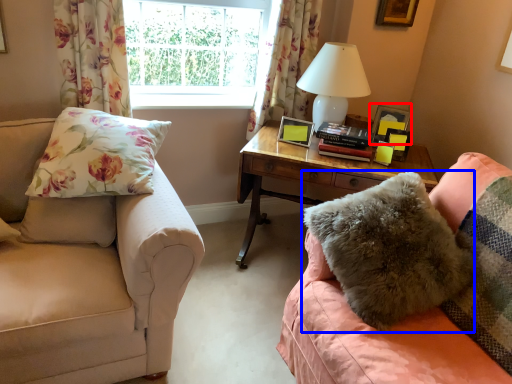
Question: Which point is closer to the camera, picture frame (highlighted by a red box) or pillow (highlighted by a blue box)?

Choices:
 (A) picture frame
 (B) pillow

Answer: (B)